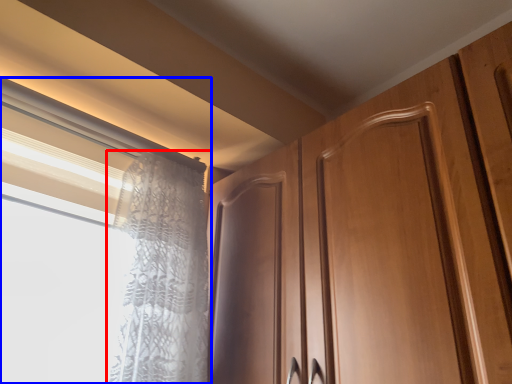
Question: Among these objects, which one is farthest to the camera, curtain (highlighted by a red box) or window (highlighted by a blue box)?

Choices:
 (A) curtain
 (B) window

Answer: (A)